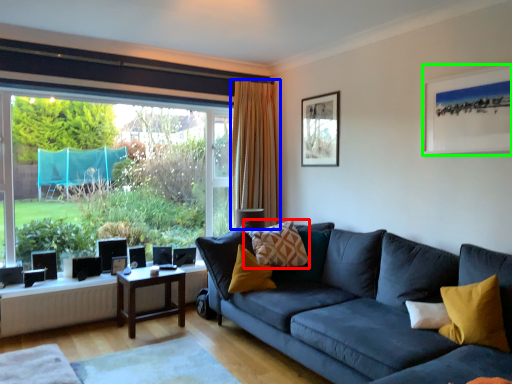
Question: Estimate the real-world distances between objects in this image. Which object is farther from pillow (highlighted by a red box), curtain (highlighted by a blue box) or picture frame (highlighted by a green box)?

Choices:
 (A) curtain
 (B) picture frame

Answer: (B)